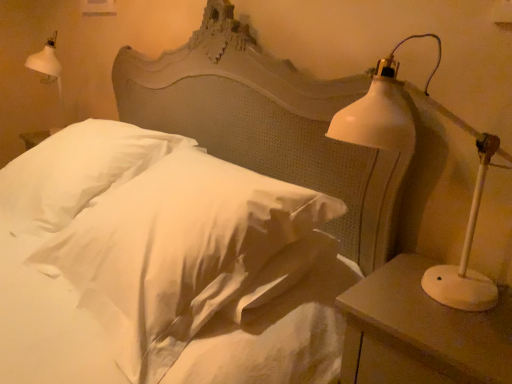
Question: Can you confirm if white matte lamp at right is bigger than white matte nightstand at right?

Choices:
 (A) no
 (B) yes

Answer: (A)

Question: Does white matte lamp at right have a greater width compared to white matte nightstand at right?

Choices:
 (A) no
 (B) yes

Answer: (A)

Question: Is white matte nightstand at right at the back of white matte lamp at right?

Choices:
 (A) no
 (B) yes

Answer: (A)

Question: Can you confirm if white matte lamp at right is smaller than white matte nightstand at right?

Choices:
 (A) yes
 (B) no

Answer: (A)

Question: From a real-world perspective, is white matte lamp at right on white matte nightstand at right?

Choices:
 (A) no
 (B) yes

Answer: (B)

Question: From the image's perspective, is white matte lamp at right beneath white matte nightstand at right?

Choices:
 (A) no
 (B) yes

Answer: (A)

Question: From the image's perspective, is white matte nightstand at right beneath white soft pillow at center, the first pillow from the left?

Choices:
 (A) no
 (B) yes

Answer: (B)

Question: Is white matte nightstand at right far from white soft pillow at center, the 2th pillow in the right-to-left sequence?

Choices:
 (A) no
 (B) yes

Answer: (B)

Question: Is the depth of white matte nightstand at right greater than that of white soft pillow at center, the 2th pillow in the right-to-left sequence?

Choices:
 (A) yes
 (B) no

Answer: (B)

Question: From a real-world perspective, is white matte nightstand at right on white soft pillow at center, the 2th pillow in the right-to-left sequence?

Choices:
 (A) yes
 (B) no

Answer: (B)

Question: Does white matte nightstand at right turn towards white soft pillow at center, the 2th pillow in the right-to-left sequence?

Choices:
 (A) no
 (B) yes

Answer: (A)

Question: Considering the relative sizes of white matte nightstand at right and white soft pillow at center, the first pillow from the left, in the image provided, is white matte nightstand at right thinner than white soft pillow at center, the first pillow from the left,?

Choices:
 (A) no
 (B) yes

Answer: (B)

Question: Considering the relative sizes of white soft pillow at center, the 2th pillow in the right-to-left sequence, and white matte nightstand at right in the image provided, is white soft pillow at center, the 2th pillow in the right-to-left sequence, shorter than white matte nightstand at right?

Choices:
 (A) no
 (B) yes

Answer: (B)